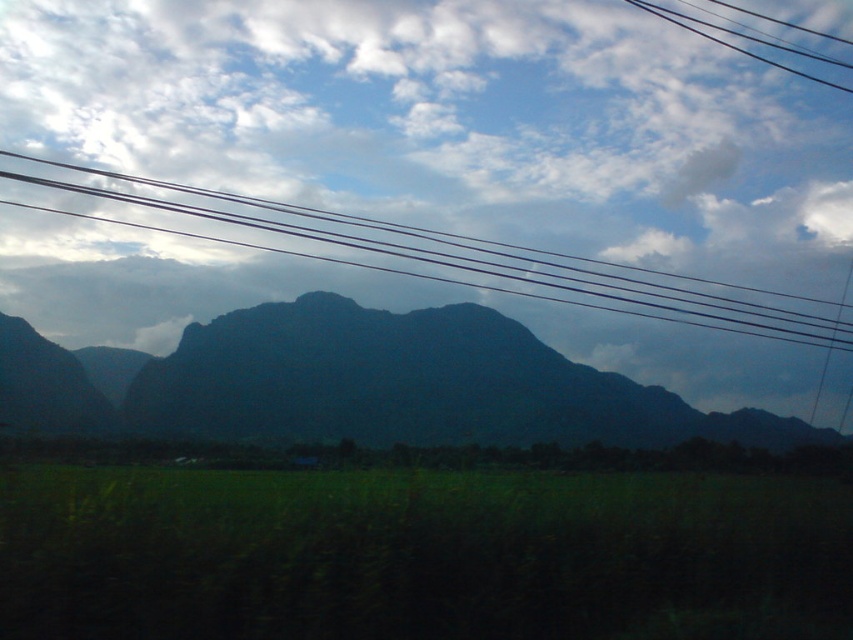
Question: Which of the following is the farthest from the observer?

Choices:
 (A) green grassy field at lower center
 (B) black wires at upper center
 (C) dark green mountain at center

Answer: (C)

Question: Which point appears closest to the camera in this image?

Choices:
 (A) (328, 628)
 (B) (140, 198)
 (C) (250, 400)

Answer: (A)

Question: Does green grassy field at lower center lie in front of black wires at upper center?

Choices:
 (A) yes
 (B) no

Answer: (A)

Question: Does green grassy field at lower center have a greater width compared to black wires at upper center?

Choices:
 (A) no
 (B) yes

Answer: (A)

Question: Which point is farther to the camera?

Choices:
 (A) (254, 588)
 (B) (578, 288)
 (C) (439, 326)

Answer: (B)

Question: Does green grassy field at lower center appear over dark green mountain at center?

Choices:
 (A) yes
 (B) no

Answer: (B)